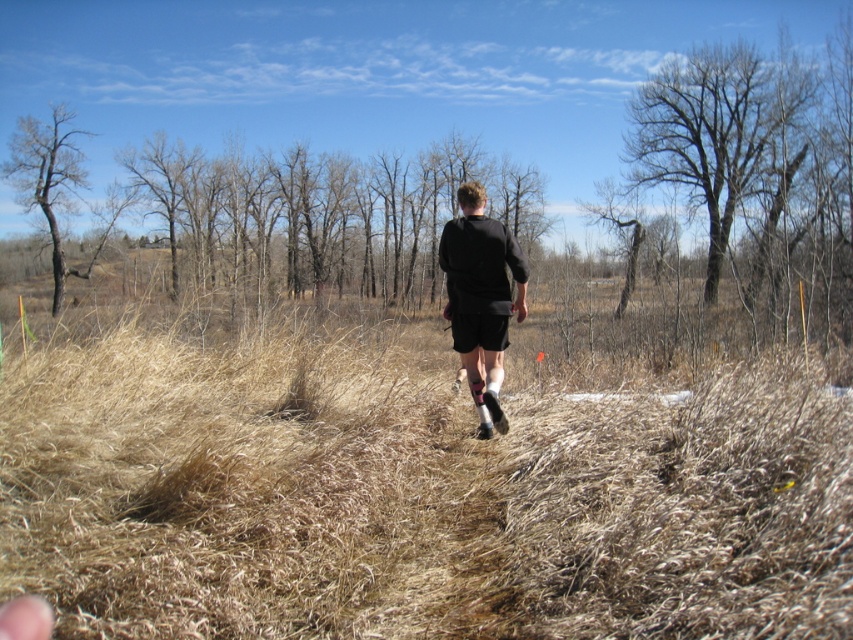
You are a photographer trying to capture the runner in the image. The camera is set to focus on the brown dry grass at center. Will the runner, who is positioned behind the grass, be in focus?

The brown dry grass at center is at point (x=415, y=492), so the runner behind it may not be in focus since the focus is set on the grass at that point.

You are a hiker trying to navigate through the dry grassy area. You notice the bare branches at center and the bare wood tree at upper right. Which one is closer to you as you face the direction the runner is moving?

The bare branches at center is closer to you because it is in front of the bare wood tree at upper right, indicating it is nearer in the line of sight.

You are a hiker who wants to take a photo of the bare branches at center and brown bark tree at left. Which one should you zoom in on to capture more details of their structures?

The brown bark tree at left is taller than the bare branches at center, so zooming in on the brown bark tree at left will allow you to capture more details of its structure.